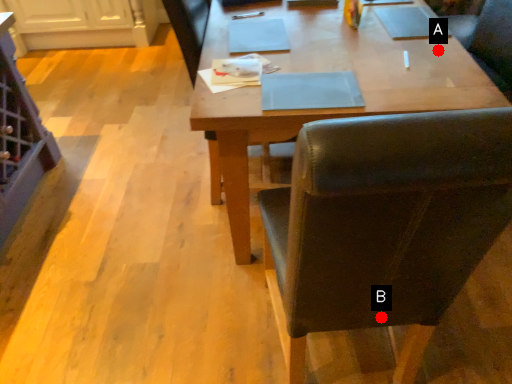
Question: Two points are circled on the image, labeled by A and B beside each circle. Which point appears farthest from the camera in this image?

Choices:
 (A) A is further
 (B) B is further

Answer: (A)